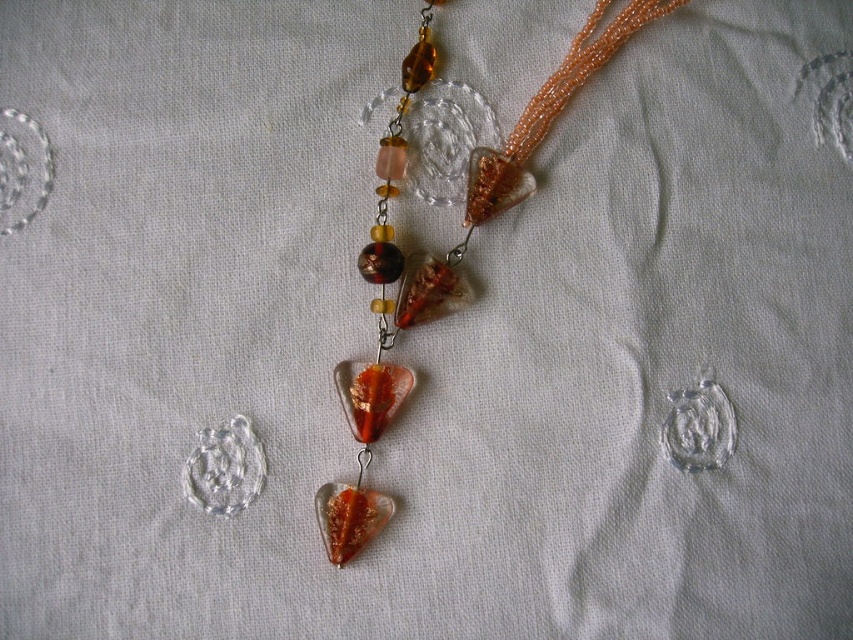
Question: Is translucent amber glass pendant at center below translucent amber glass heart at center?

Choices:
 (A) yes
 (B) no

Answer: (B)

Question: Which object is closer to the camera taking this photo?

Choices:
 (A) translucent amber glass pendant at center
 (B) translucent amber glass heart at center

Answer: (B)

Question: Which object appears closest to the camera in this image?

Choices:
 (A) translucent amber glass pendant at center
 (B) translucent amber glass heart at center

Answer: (B)

Question: Where is translucent amber glass pendant at center located in relation to translucent amber glass heart at center in the image?

Choices:
 (A) left
 (B) right

Answer: (B)

Question: Can you confirm if translucent amber glass pendant at center is wider than translucent amber glass heart at center?

Choices:
 (A) no
 (B) yes

Answer: (B)